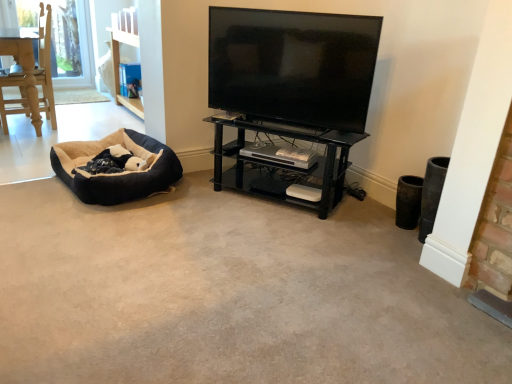
Question: Considering the relative sizes of black glossy tv at upper center and black glass shelf at center in the image provided, is black glossy tv at upper center wider than black glass shelf at center?

Choices:
 (A) yes
 (B) no

Answer: (B)

Question: From the image's perspective, is black glossy tv at upper center below black glass shelf at center?

Choices:
 (A) no
 (B) yes

Answer: (A)

Question: Is black glossy tv at upper center facing away from black glass shelf at center?

Choices:
 (A) yes
 (B) no

Answer: (B)

Question: From the image's perspective, is black glossy tv at upper center located above black glass shelf at center?

Choices:
 (A) yes
 (B) no

Answer: (A)

Question: Does black glossy tv at upper center have a greater height compared to black glass shelf at center?

Choices:
 (A) no
 (B) yes

Answer: (B)

Question: Is soft suede dog bed at left inside the boundaries of black glass shelf at center, or outside?

Choices:
 (A) inside
 (B) outside

Answer: (B)

Question: From a real-world perspective, is soft suede dog bed at left above or below black glass shelf at center?

Choices:
 (A) below
 (B) above

Answer: (A)

Question: Visually, is soft suede dog bed at left positioned to the left or to the right of black glass shelf at center?

Choices:
 (A) right
 (B) left

Answer: (B)

Question: Does point (61, 178) appear closer or farther from the camera than point (333, 205)?

Choices:
 (A) closer
 (B) farther

Answer: (B)

Question: In the image, is black glass shelf at center positioned in front of or behind black glossy tv at upper center?

Choices:
 (A) front
 (B) behind

Answer: (B)

Question: From a real-world perspective, is black glass shelf at center above or below black glossy tv at upper center?

Choices:
 (A) above
 (B) below

Answer: (B)

Question: From the image's perspective, is black glass shelf at center positioned above or below black glossy tv at upper center?

Choices:
 (A) below
 (B) above

Answer: (A)

Question: Is point (243, 180) closer or farther from the camera than point (300, 91)?

Choices:
 (A) farther
 (B) closer

Answer: (A)

Question: Considering the positions of black glass shelf at center and soft suede dog bed at left in the image, is black glass shelf at center taller or shorter than soft suede dog bed at left?

Choices:
 (A) short
 (B) tall

Answer: (B)

Question: Is point (240, 160) closer or farther from the camera than point (145, 188)?

Choices:
 (A) closer
 (B) farther

Answer: (B)